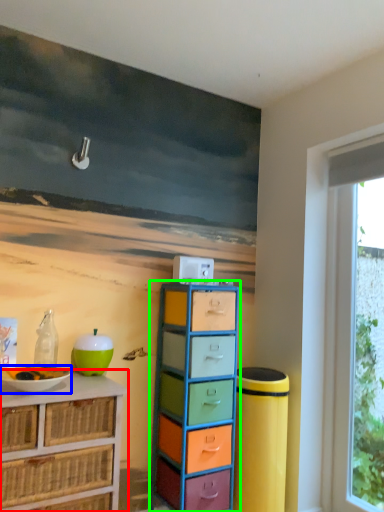
Question: Based on their relative distances, which object is nearer to chest of drawers (highlighted by a red box)? Choose from bowl (highlighted by a blue box) and chest of drawers (highlighted by a green box).

Choices:
 (A) bowl
 (B) chest of drawers

Answer: (A)